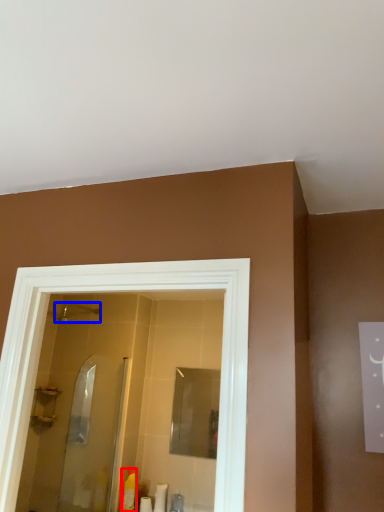
Question: Among these objects, which one is nearest to the camera, toiletry (highlighted by a red box) or shower (highlighted by a blue box)?

Choices:
 (A) toiletry
 (B) shower

Answer: (A)